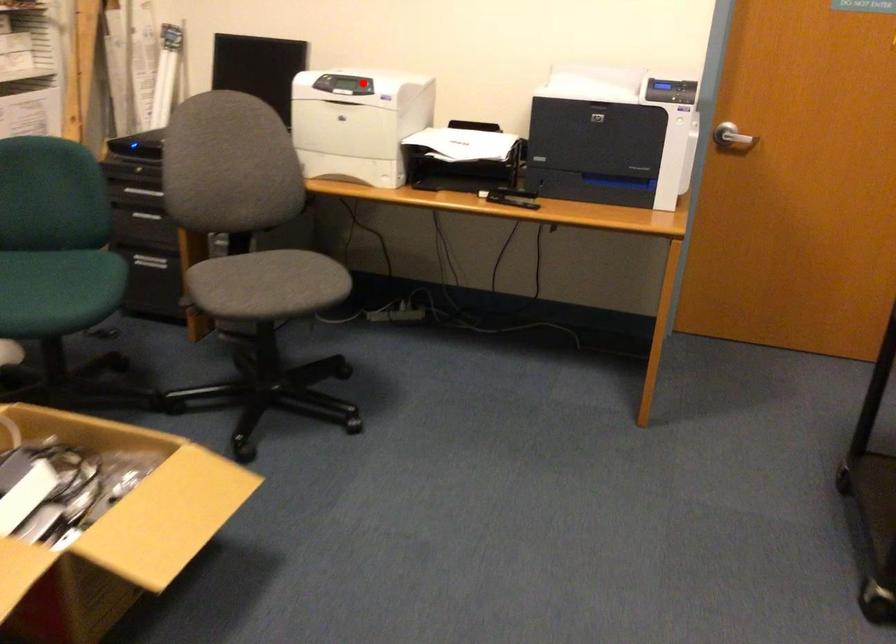
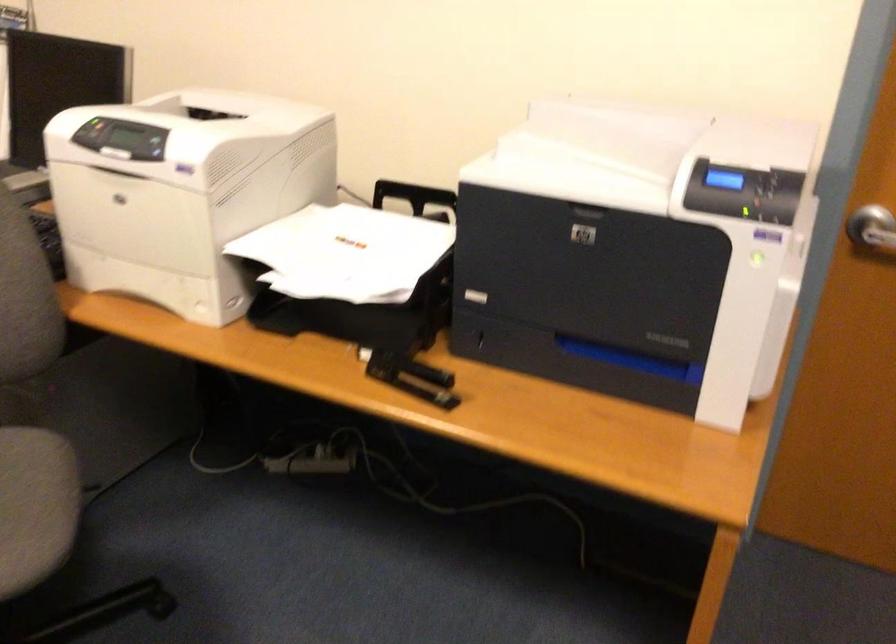
Question: A red point is marked in image1. In image2, is the corresponding 3D point closer to the camera or farther? Reply with the corresponding letter.

Choices:
 (A) The corresponding 3D point is closer.
 (B) The corresponding 3D point is farther.

Answer: (A)